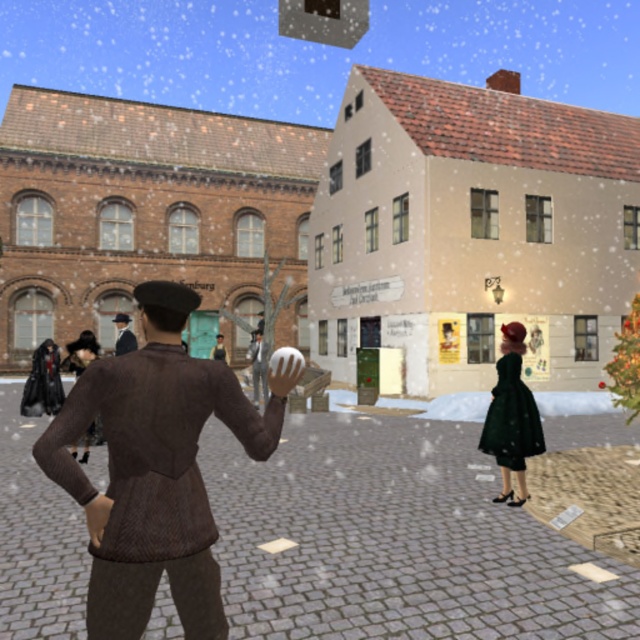
In the snowy town square scene, you see a velvet green dress at right and a brown wool coat at center. Which object is positioned more to the right side of the image?

The velvet green dress at right is positioned more to the right side of the image compared to the brown wool coat at center.

You are a tailor in the town square observing two brown garments at center. Which one is closer to you, the brown knitted sweater at center or the brown wool coat at center?

The brown knitted sweater at center is closer to you because it is in front of the brown wool coat at center.

You are a tailor in this historical town square, and you need to determine which coat to recommend to a customer who prefers a more voluminous style. Based on the image, which coat is larger between the brown wool coat at center and the brown leather coat at center?

The brown wool coat at center is bigger than the brown leather coat at center, so it would be the better recommendation for a more voluminous style.